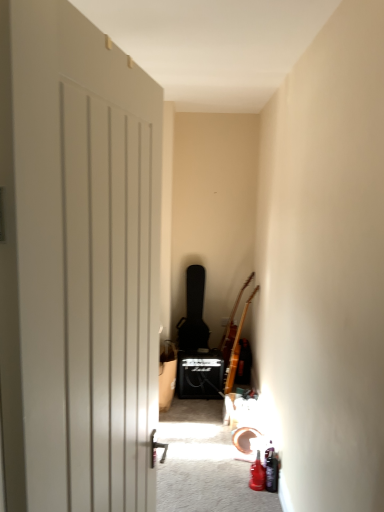
This screenshot has height=512, width=384. What do you see at coordinates (194, 313) in the screenshot?
I see `black matte guitar case at center, arranged as the first guitar when viewed from the left` at bounding box center [194, 313].

At what (x,y) coordinates should I click in order to perform the action: click on brown wooden guitar at upper right, which is counted as the 2th guitar, starting from the left. Please return your answer as a coordinate pair (x, y). Looking at the image, I should click on (234, 311).

Locate an element on the screen. black matte guitar case at center, the third guitar in the right-to-left sequence is located at coordinates (194, 313).

How different are the orientations of black matte guitar case at center, arranged as the first guitar when viewed from the left, and brown wooden guitar at upper right, which is counted as the 2th guitar, starting from the left, in degrees?

The angle between the facing direction of black matte guitar case at center, arranged as the first guitar when viewed from the left, and the facing direction of brown wooden guitar at upper right, which is counted as the 2th guitar, starting from the left, is 93.6 degrees.

Looking at this image, from the image's perspective, is black matte guitar case at center, the third guitar in the right-to-left sequence, above brown wooden guitar at upper right, which is counted as the 2th guitar, starting from the left?

Correct, black matte guitar case at center, the third guitar in the right-to-left sequence, appears higher than brown wooden guitar at upper right, which is counted as the 2th guitar, starting from the left, in the image.

From their relative heights in the image, would you say black matte guitar case at center, arranged as the first guitar when viewed from the left, is taller or shorter than brown wooden guitar at upper right, the second guitar when ordered from right to left?

Clearly, black matte guitar case at center, arranged as the first guitar when viewed from the left, is taller compared to brown wooden guitar at upper right, the second guitar when ordered from right to left.

Would you consider black matte guitar case at center, the third guitar in the right-to-left sequence, to be distant from brown wooden guitar at upper right, the second guitar when ordered from right to left?

They are positioned close to each other.

From a real-world perspective, count 2nd guitars upward from the wooden acoustic guitar at right, which is the 3th guitar in left-to-right order, and point to it. Please provide its 2D coordinates.

[(194, 313)]

Which of these two, black matte guitar case at center, the third guitar in the right-to-left sequence, or wooden acoustic guitar at right, which is the 3th guitar in left-to-right order, is smaller?

Smaller between the two is wooden acoustic guitar at right, which is the 3th guitar in left-to-right order.

Which of these two, black matte guitar case at center, the third guitar in the right-to-left sequence, or wooden acoustic guitar at right, which is the 3th guitar in left-to-right order, stands shorter?

black matte guitar case at center, the third guitar in the right-to-left sequence.

Does black matte guitar case at center, the third guitar in the right-to-left sequence, turn towards wooden acoustic guitar at right, positioned as the first guitar in right-to-left order?

No, black matte guitar case at center, the third guitar in the right-to-left sequence, is not facing towards wooden acoustic guitar at right, positioned as the first guitar in right-to-left order.

Can we say wooden acoustic guitar at right, which is the 3th guitar in left-to-right order, lies outside black matte guitar case at center, arranged as the first guitar when viewed from the left?

That's correct, wooden acoustic guitar at right, which is the 3th guitar in left-to-right order, is outside of black matte guitar case at center, arranged as the first guitar when viewed from the left.

Is wooden acoustic guitar at right, positioned as the first guitar in right-to-left order, positioned with its back to black matte guitar case at center, the third guitar in the right-to-left sequence?

No.

Which object is further away from the camera taking this photo, wooden acoustic guitar at right, positioned as the first guitar in right-to-left order, or black matte guitar case at center, the third guitar in the right-to-left sequence?

black matte guitar case at center, the third guitar in the right-to-left sequence.

What's the angular difference between wooden acoustic guitar at right, positioned as the first guitar in right-to-left order, and black matte guitar case at center, the third guitar in the right-to-left sequence,'s facing directions?

The facing directions of wooden acoustic guitar at right, positioned as the first guitar in right-to-left order, and black matte guitar case at center, the third guitar in the right-to-left sequence, are 93.6 degrees apart.

From a real-world perspective, which object rests below the other?

From a 3D spatial view, brown wooden guitar at upper right, which is counted as the 2th guitar, starting from the left, is below.

Is brown wooden guitar at upper right, which is counted as the 2th guitar, starting from the left, to the right of black matte guitar case at center, arranged as the first guitar when viewed from the left, from the viewer's perspective?

Yes.

What's the angular difference between brown wooden guitar at upper right, which is counted as the 2th guitar, starting from the left, and black matte guitar case at center, arranged as the first guitar when viewed from the left,'s facing directions?

→ 93.6 degrees separate the facing orientations of brown wooden guitar at upper right, which is counted as the 2th guitar, starting from the left, and black matte guitar case at center, arranged as the first guitar when viewed from the left.

Where is `guitar to the left of brown wooden guitar at upper right, which is counted as the 2th guitar, starting from the left`? guitar to the left of brown wooden guitar at upper right, which is counted as the 2th guitar, starting from the left is located at coordinates [194, 313].

Visually, is wooden acoustic guitar at right, which is the 3th guitar in left-to-right order, positioned to the left or to the right of brown wooden guitar at upper right, which is counted as the 2th guitar, starting from the left?

From the image, it's evident that wooden acoustic guitar at right, which is the 3th guitar in left-to-right order, is to the right of brown wooden guitar at upper right, which is counted as the 2th guitar, starting from the left.

From the picture: From a real-world perspective, is wooden acoustic guitar at right, positioned as the first guitar in right-to-left order, on top of brown wooden guitar at upper right, the second guitar when ordered from right to left?

No, from a real-world perspective, wooden acoustic guitar at right, positioned as the first guitar in right-to-left order, is not over brown wooden guitar at upper right, the second guitar when ordered from right to left

Is wooden acoustic guitar at right, which is the 3th guitar in left-to-right order, looking in the opposite direction of brown wooden guitar at upper right, which is counted as the 2th guitar, starting from the left?

No, wooden acoustic guitar at right, which is the 3th guitar in left-to-right order,'s orientation is not away from brown wooden guitar at upper right, which is counted as the 2th guitar, starting from the left.

Which is less distant, (235, 370) or (227, 337)?

Point (235, 370).

Can you confirm if brown wooden guitar at upper right, which is counted as the 2th guitar, starting from the left, is shorter than wooden acoustic guitar at right, which is the 3th guitar in left-to-right order?

Yes.

Can you tell me how much brown wooden guitar at upper right, the second guitar when ordered from right to left, and wooden acoustic guitar at right, which is the 3th guitar in left-to-right order, differ in facing direction?

9.12e-05 degrees separate the facing orientations of brown wooden guitar at upper right, the second guitar when ordered from right to left, and wooden acoustic guitar at right, which is the 3th guitar in left-to-right order.

Does brown wooden guitar at upper right, the second guitar when ordered from right to left, have a lesser width compared to wooden acoustic guitar at right, which is the 3th guitar in left-to-right order?

Incorrect, the width of brown wooden guitar at upper right, the second guitar when ordered from right to left, is not less than that of wooden acoustic guitar at right, which is the 3th guitar in left-to-right order.

Does brown wooden guitar at upper right, which is counted as the 2th guitar, starting from the left, contain wooden acoustic guitar at right, positioned as the first guitar in right-to-left order?

No, brown wooden guitar at upper right, which is counted as the 2th guitar, starting from the left, does not contain wooden acoustic guitar at right, positioned as the first guitar in right-to-left order.

This screenshot has width=384, height=512. I want to click on guitar behind the brown wooden guitar at upper right, the second guitar when ordered from right to left, so click(x=194, y=313).

The height and width of the screenshot is (512, 384). What are the coordinates of `the 2nd guitar above the wooden acoustic guitar at right, which is the 3th guitar in left-to-right order (from a real-world perspective)` in the screenshot? It's located at (194, 313).

Estimate the real-world distances between objects in this image. Which object is further from black matte guitar case at center, arranged as the first guitar when viewed from the left, wooden acoustic guitar at right, which is the 3th guitar in left-to-right order, or brown wooden guitar at upper right, the second guitar when ordered from right to left?

wooden acoustic guitar at right, which is the 3th guitar in left-to-right order, lies further to black matte guitar case at center, arranged as the first guitar when viewed from the left, than the other object.

When comparing their distances from black matte guitar case at center, arranged as the first guitar when viewed from the left, does brown wooden guitar at upper right, which is counted as the 2th guitar, starting from the left, or wooden acoustic guitar at right, which is the 3th guitar in left-to-right order, seem closer?

brown wooden guitar at upper right, which is counted as the 2th guitar, starting from the left, is closer to black matte guitar case at center, arranged as the first guitar when viewed from the left.

From the image, which object appears to be farther from wooden acoustic guitar at right, positioned as the first guitar in right-to-left order, black matte guitar case at center, the third guitar in the right-to-left sequence, or brown wooden guitar at upper right, the second guitar when ordered from right to left?

The object further to wooden acoustic guitar at right, positioned as the first guitar in right-to-left order, is black matte guitar case at center, the third guitar in the right-to-left sequence.

When comparing their distances from brown wooden guitar at upper right, which is counted as the 2th guitar, starting from the left, does black matte guitar case at center, arranged as the first guitar when viewed from the left, or wooden acoustic guitar at right, which is the 3th guitar in left-to-right order, seem further?

The object further to brown wooden guitar at upper right, which is counted as the 2th guitar, starting from the left, is black matte guitar case at center, arranged as the first guitar when viewed from the left.

Estimate the real-world distances between objects in this image. Which object is further from brown wooden guitar at upper right, which is counted as the 2th guitar, starting from the left, wooden acoustic guitar at right, positioned as the first guitar in right-to-left order, or black matte guitar case at center, arranged as the first guitar when viewed from the left?

black matte guitar case at center, arranged as the first guitar when viewed from the left, is further to brown wooden guitar at upper right, which is counted as the 2th guitar, starting from the left.

When comparing their distances from wooden acoustic guitar at right, which is the 3th guitar in left-to-right order, does brown wooden guitar at upper right, the second guitar when ordered from right to left, or black matte guitar case at center, arranged as the first guitar when viewed from the left, seem closer?

brown wooden guitar at upper right, the second guitar when ordered from right to left, is positioned closer to the anchor wooden acoustic guitar at right, which is the 3th guitar in left-to-right order.

Find the location of a particular element. guitar between wooden acoustic guitar at right, which is the 3th guitar in left-to-right order, and black matte guitar case at center, arranged as the first guitar when viewed from the left, along the z-axis is located at coordinates point(234,311).